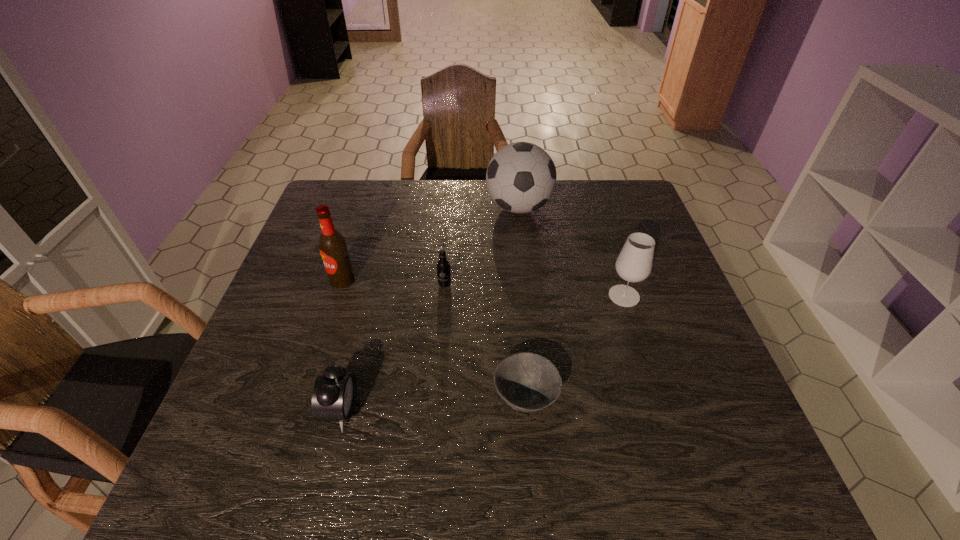
Locate an element on the screen. This screenshot has width=960, height=540. free region at the left edge is located at coordinates (316, 352).

I want to click on free space at the right edge of the desktop, so click(705, 351).

The width and height of the screenshot is (960, 540). Identify the location of vacant space at the far left corner. (362, 180).

Where is `blank space at the near left corner of the desktop`? The image size is (960, 540). blank space at the near left corner of the desktop is located at coordinates (199, 463).

Locate an element on the screen. The width and height of the screenshot is (960, 540). vacant space at the far right corner is located at coordinates (642, 217).

The width and height of the screenshot is (960, 540). Identify the location of vacant region between the fourth tallest object and the glass. (535, 290).

Identify the location of free spot between the third tallest object and the leftmost object. Image resolution: width=960 pixels, height=540 pixels. (484, 288).

I want to click on vacant area between the fourth tallest object and the shortest object, so click(485, 341).

At what (x,y) coordinates should I click in order to perform the action: click on unoccupied area between the farthest object and the third shortest object. Please return your answer as a coordinate pair (x, y). Looking at the image, I should click on (482, 246).

Image resolution: width=960 pixels, height=540 pixels. What are the coordinates of `unoccupied position between the rightmost object and the farthest object` in the screenshot? It's located at (571, 252).